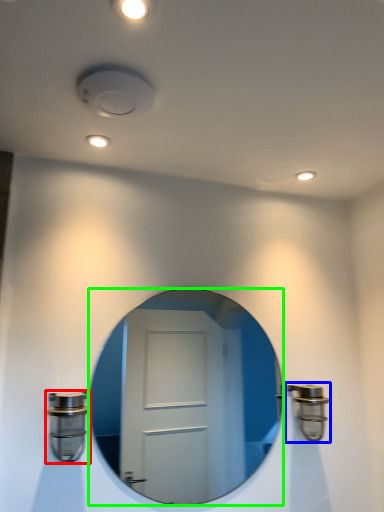
Question: Which is nearer to the door handle (highlighted by a red box)? door handle (highlighted by a blue box) or mirror (highlighted by a green box).

Choices:
 (A) door handle
 (B) mirror

Answer: (A)